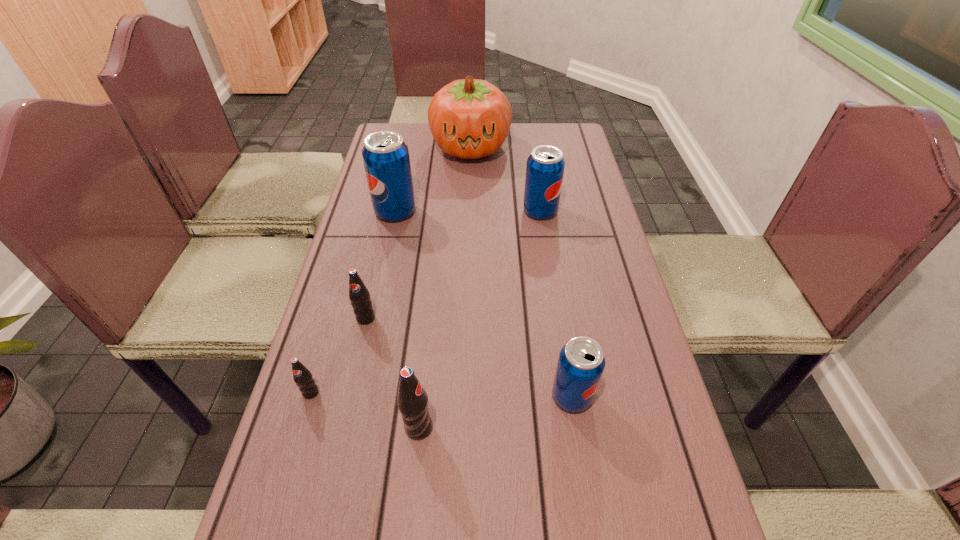
Where is `the shortest object`? the shortest object is located at coordinates (302, 376).

Find the location of `the second nearest black pop`. the second nearest black pop is located at coordinates (302, 376).

Identify the location of vacant space located on the side of the green pumpkin with the cute face. (468, 223).

You are a GUI agent. You are given a task and a screenshot of the screen. Output one action in this format:
    pyautogui.click(x=<x>, y=<y>)
    Task: Click on the vacant position located on the back of the leftmost blue pop soda
    
    Given the screenshot: What is the action you would take?
    pyautogui.click(x=410, y=144)

The height and width of the screenshot is (540, 960). In order to click on vacant space situated on the left of the second biggest blue pop soda in this screenshot , I will do `click(499, 211)`.

The width and height of the screenshot is (960, 540). In order to click on vacant space located 0.340m on the front label of the nearest black pop in this screenshot , I will do `click(610, 427)`.

Where is `vacant point located 0.210m on the front of the smallest blue pop soda`? vacant point located 0.210m on the front of the smallest blue pop soda is located at coordinates (594, 536).

At what (x,y) coordinates should I click in order to perform the action: click on free spot located on the front label of the third farthest pop. Please return your answer as a coordinate pair (x, y). The image size is (960, 540). Looking at the image, I should click on (352, 379).

Image resolution: width=960 pixels, height=540 pixels. Find the location of `vacant position located 0.090m on the front label of the smallest black pop`. vacant position located 0.090m on the front label of the smallest black pop is located at coordinates (296, 444).

Locate an element on the screen. object located in the far edge section of the desktop is located at coordinates (469, 118).